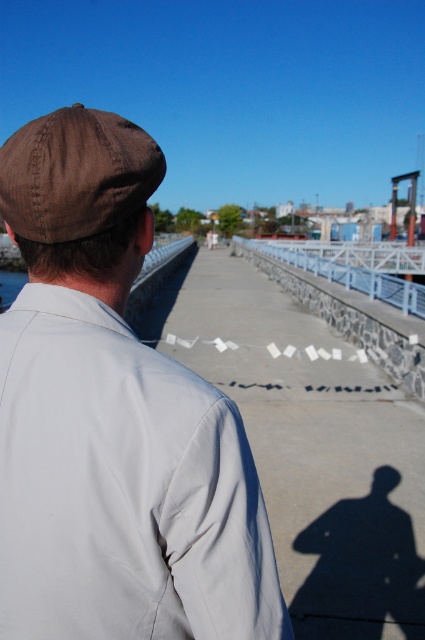
Who is more forward, (118,141) or (288,246)?

Positioned in front is point (118,141).

What do you see at coordinates (113, 419) in the screenshot?
I see `brown fabric cap at upper left` at bounding box center [113, 419].

What do you see at coordinates (113, 419) in the screenshot? I see `brown fabric cap at upper left` at bounding box center [113, 419].

Find the location of a particular element. brown fabric cap at upper left is located at coordinates (113, 419).

Does brown fabric baseball cap at upper left come in front of white metal rail at center?

Yes, it is.

The image size is (425, 640). What do you see at coordinates (76, 173) in the screenshot?
I see `brown fabric baseball cap at upper left` at bounding box center [76, 173].

I want to click on brown fabric baseball cap at upper left, so click(76, 173).

Locate an element on the screen. The image size is (425, 640). brown fabric baseball cap at upper left is located at coordinates (76, 173).

Does brown fabric cap at upper left appear over brown fabric baseball cap at upper left?

Incorrect, brown fabric cap at upper left is not positioned above brown fabric baseball cap at upper left.

Is brown fabric cap at upper left to the right of brown fabric baseball cap at upper left from the viewer's perspective?

Yes, brown fabric cap at upper left is to the right of brown fabric baseball cap at upper left.

Locate an element on the screen. brown fabric cap at upper left is located at coordinates (113, 419).